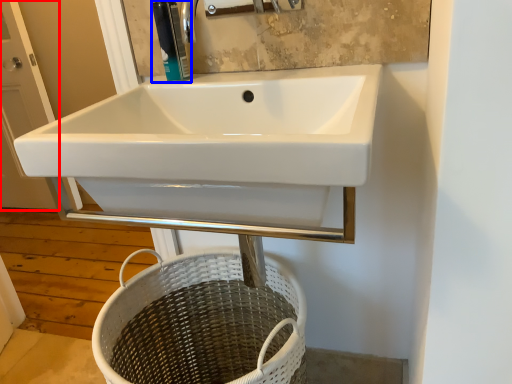
Question: Which of the following is the closest to the observer, screen door (highlighted by a red box) or soap dispenser (highlighted by a blue box)?

Choices:
 (A) screen door
 (B) soap dispenser

Answer: (B)